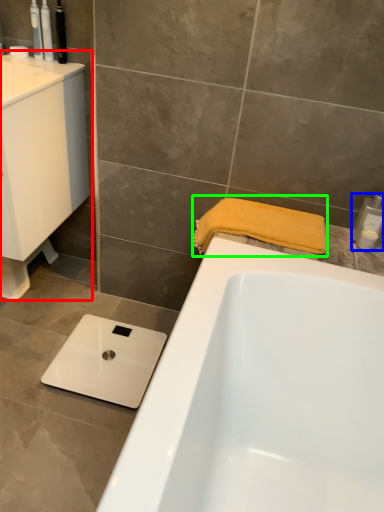
Question: Which object is positioned farthest from sink (highlighted by a red box)? Select from toiletry (highlighted by a blue box) and bath towel (highlighted by a green box).

Choices:
 (A) toiletry
 (B) bath towel

Answer: (A)